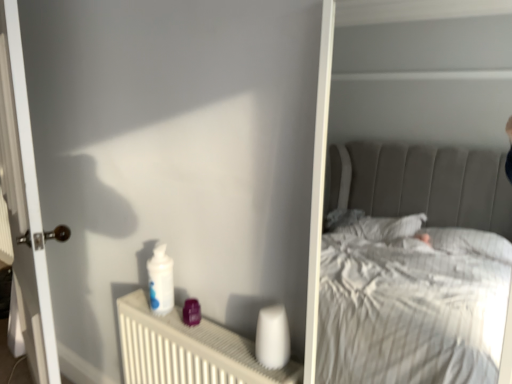
Question: Should I look upward or downward to see white glossy door at left?

Choices:
 (A) up
 (B) down

Answer: (B)

Question: Is white plastic radiator at lower center taller than white glossy door at left?

Choices:
 (A) yes
 (B) no

Answer: (B)

Question: Is white plastic radiator at lower center outside white glossy door at left?

Choices:
 (A) no
 (B) yes

Answer: (B)

Question: Is white plastic radiator at lower center positioned far away from white glossy door at left?

Choices:
 (A) yes
 (B) no

Answer: (B)

Question: Considering the relative sizes of white plastic radiator at lower center and white glossy door at left in the image provided, is white plastic radiator at lower center wider than white glossy door at left?

Choices:
 (A) yes
 (B) no

Answer: (B)

Question: From the image's perspective, is white plastic radiator at lower center on top of white glossy door at left?

Choices:
 (A) no
 (B) yes

Answer: (A)

Question: Is the surface of white plastic radiator at lower center in direct contact with white glossy door at left?

Choices:
 (A) no
 (B) yes

Answer: (A)

Question: From a real-world perspective, does white glossy door at left stand above white plastic radiator at lower center?

Choices:
 (A) no
 (B) yes

Answer: (B)

Question: Does white glossy door at left contain white plastic radiator at lower center?

Choices:
 (A) no
 (B) yes

Answer: (A)

Question: Does white glossy door at left turn towards white plastic radiator at lower center?

Choices:
 (A) yes
 (B) no

Answer: (B)

Question: Is white glossy door at left wider than white plastic radiator at lower center?

Choices:
 (A) yes
 (B) no

Answer: (A)

Question: From the image's perspective, is white glossy door at left over white plastic radiator at lower center?

Choices:
 (A) no
 (B) yes

Answer: (B)

Question: Is white glossy door at left at the right side of white plastic radiator at lower center?

Choices:
 (A) yes
 (B) no

Answer: (B)

Question: Is white plastic radiator at lower center to the left or to the right of white glossy door at left in the image?

Choices:
 (A) right
 (B) left

Answer: (A)